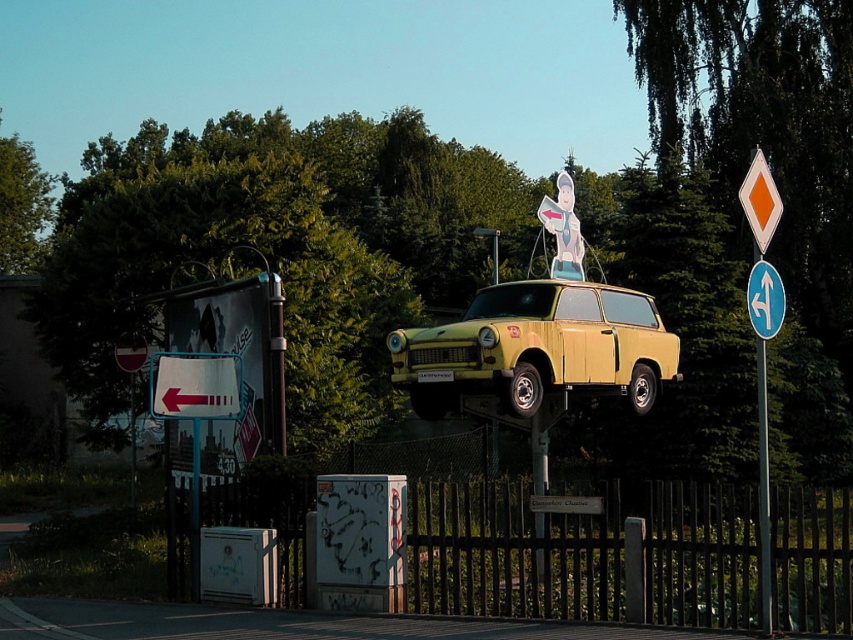
Question: Where is yellow matte car at center located in relation to blue plastic arrow at upper center in the image?

Choices:
 (A) left
 (B) right

Answer: (A)

Question: Which is farther from the white plastic sign at left?

Choices:
 (A) yellow matte car at center
 (B) wooden fence at lower center
 (C) metallic pole at center
 (D) blue plastic arrow at upper center

Answer: (B)

Question: Is white plastic sign at left smaller than metallic pole at center?

Choices:
 (A) yes
 (B) no

Answer: (B)

Question: Which object is farther from the camera taking this photo?

Choices:
 (A) metallic pole at center
 (B) yellow matte car at center
 (C) white plastic sign at left

Answer: (C)

Question: Can you confirm if yellow matte car at center is positioned to the right of metallic pole at center?

Choices:
 (A) yes
 (B) no

Answer: (B)

Question: Which object is the farthest from the metallic gray utility box at lower left?

Choices:
 (A) metallic pole at center
 (B) blue plastic arrow at upper center

Answer: (B)